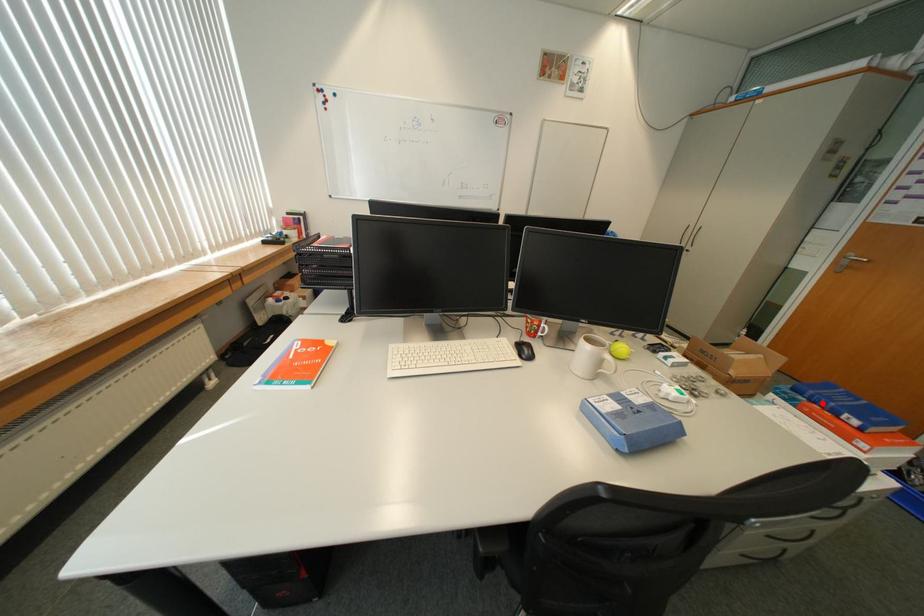
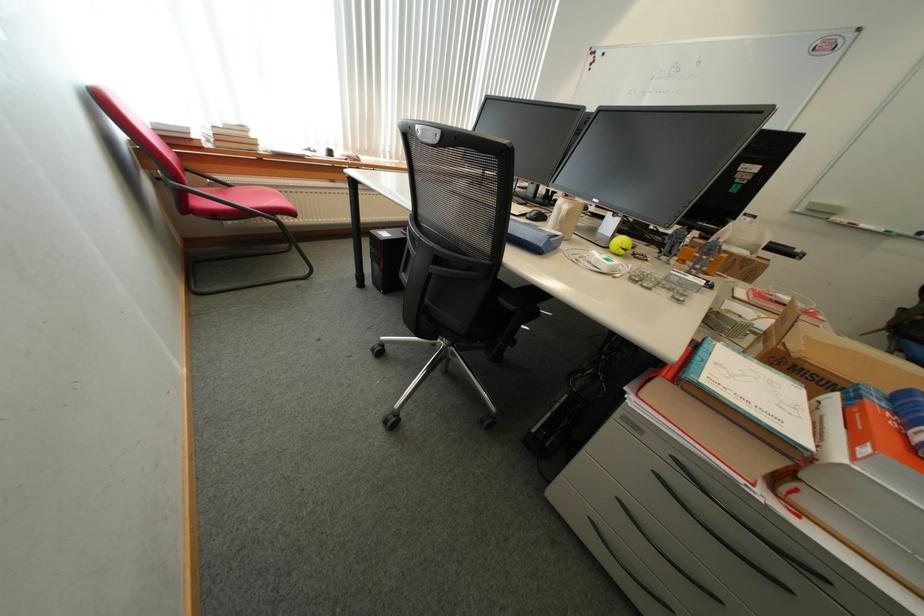
Question: I am providing you with two images of the same scene from different viewpoints. In image1, a red point is highlighted. Considering the same 3D point in image2, which of the following is correct?

Choices:
 (A) It is closer
 (B) It is farther

Answer: (A)